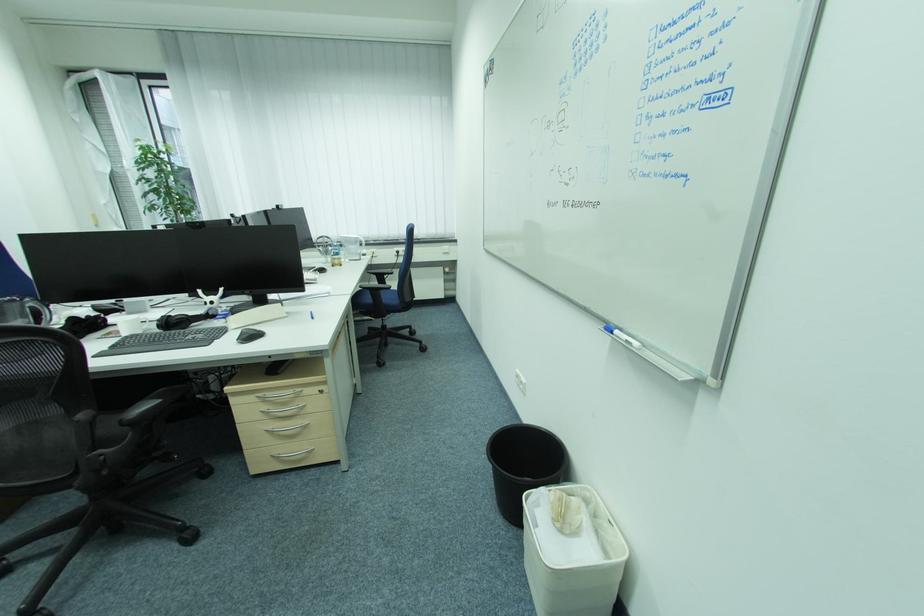
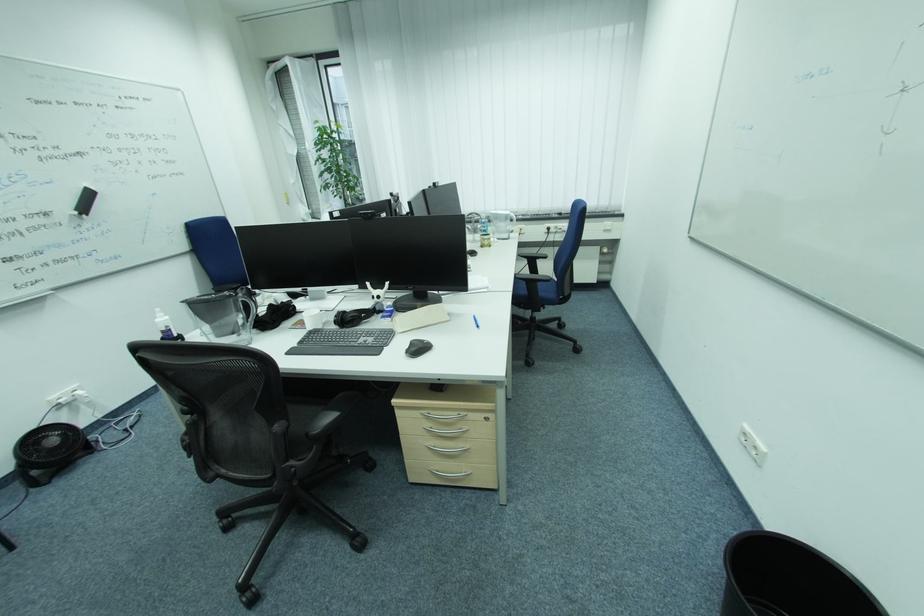
The point at (281, 430) is marked in the first image. Where is the corresponding point in the second image?

(441, 448)